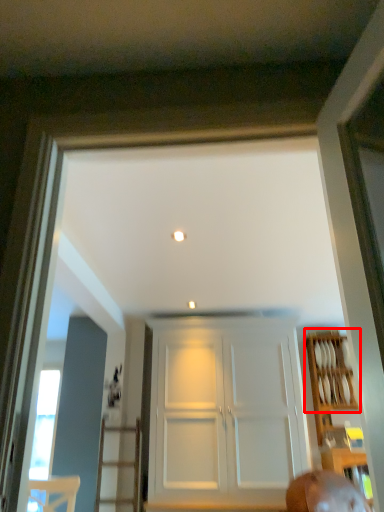
Question: In this image, where is shelf (annotated by the red box) located relative to door?

Choices:
 (A) left
 (B) right

Answer: (B)